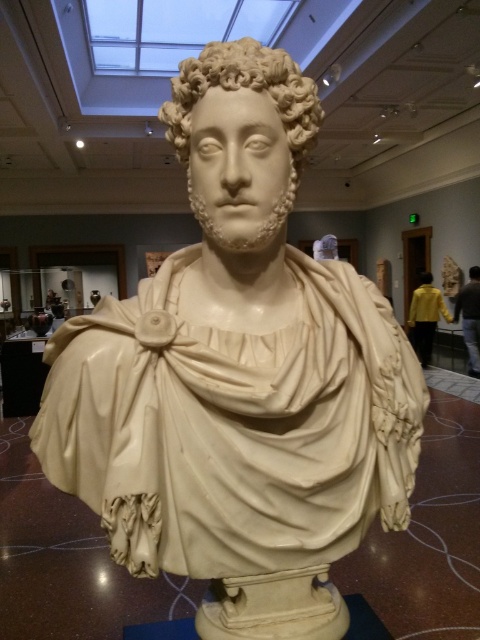
You are a visitor standing in front of the classical marble bust in the museum. You notice two points marked on the bust. The first point is at coordinates point (272,52) and the second point is at point (474,280). Which of these points is nearer to your viewpoint?

Point (272,52) is closer to the viewer than point (474,280).

You are a museum visitor standing in front of the white marble bust at center. You want to take a photo of it without any obstructions. The museum has a rule that visitors must stay at least 2 meters away from the exhibits. Given that the bust is located at coordinates point 0.142, 0.529, can you position yourself in a way that allows you to take a clear photo while adhering to the museum rules?

The white marble bust at center is located at point (253, 90). Since the museum requires visitors to stay at least 2 meters away from exhibits, you must position yourself at least 2 meters back from the bust to take the photo without obstruction while following the rules.

You are a museum visitor standing in front of the exhibits. You see the white marble bust at center and the ivory sculpture at center. Which object is positioned lower in the image?

The white marble bust at center is positioned lower than the ivory sculpture at center.